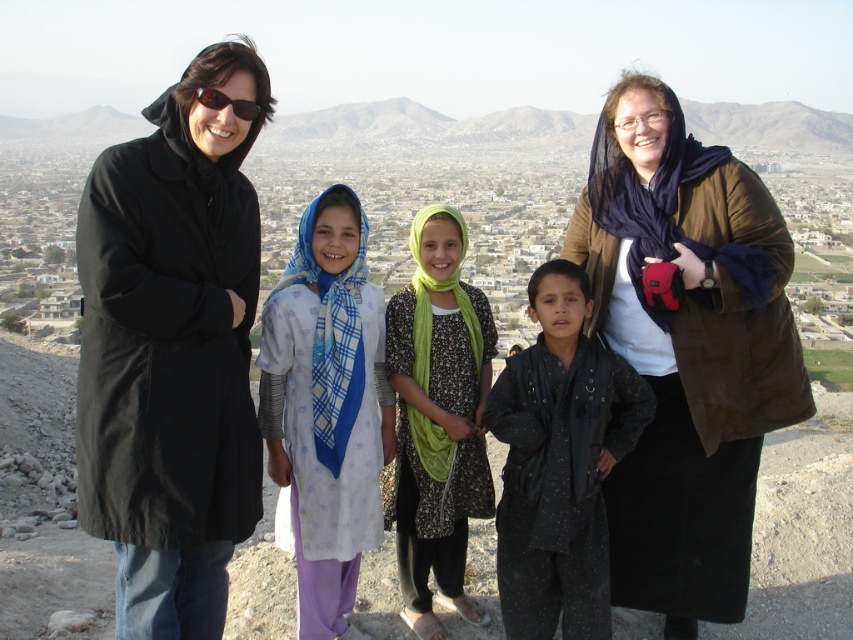
Question: Considering the real-world distances, which object is farthest from the black textured jacket at center?

Choices:
 (A) brown suede jacket at upper right
 (B) black fabric coat at left

Answer: (B)

Question: Is black fabric coat at left closer to camera compared to brown suede jacket at upper right?

Choices:
 (A) yes
 (B) no

Answer: (A)

Question: Among these objects, which one is farthest from the camera?

Choices:
 (A) black textured jacket at center
 (B) black fabric coat at left
 (C) brown suede jacket at upper right

Answer: (A)

Question: Can you confirm if brown suede jacket at upper right is smaller than light purple fabric dress at center?

Choices:
 (A) yes
 (B) no

Answer: (B)

Question: Is brown suede jacket at upper right in front of black textured jacket at center?

Choices:
 (A) no
 (B) yes

Answer: (B)

Question: Which of the following is the farthest from the observer?

Choices:
 (A) (606, 214)
 (B) (566, 320)
 (C) (260, 387)

Answer: (A)